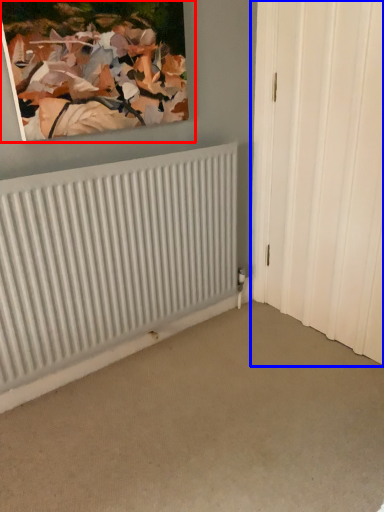
Question: Which object is closer to the camera taking this photo, picture frame (highlighted by a red box) or door (highlighted by a blue box)?

Choices:
 (A) picture frame
 (B) door

Answer: (A)